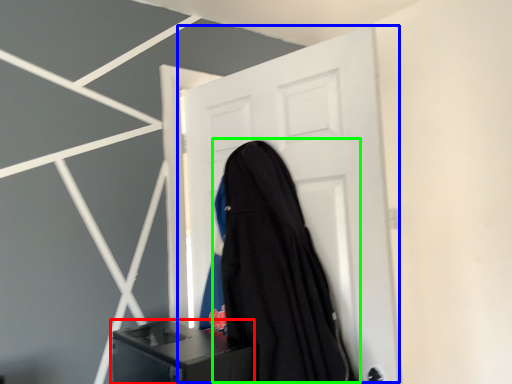
Question: Based on their relative distances, which object is farther from furniture (highlighted by a red box)? Choose from door (highlighted by a blue box) and garment (highlighted by a green box).

Choices:
 (A) door
 (B) garment

Answer: (A)